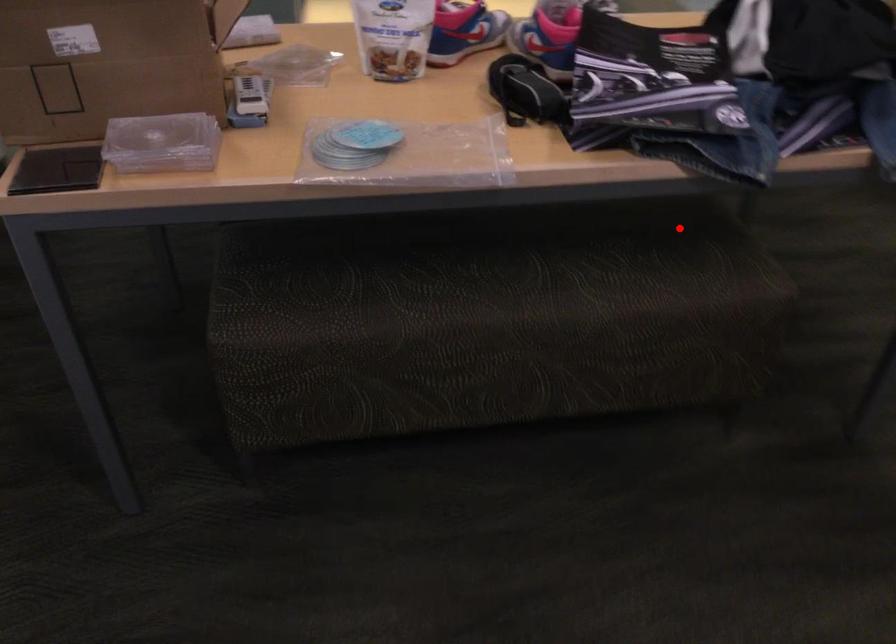
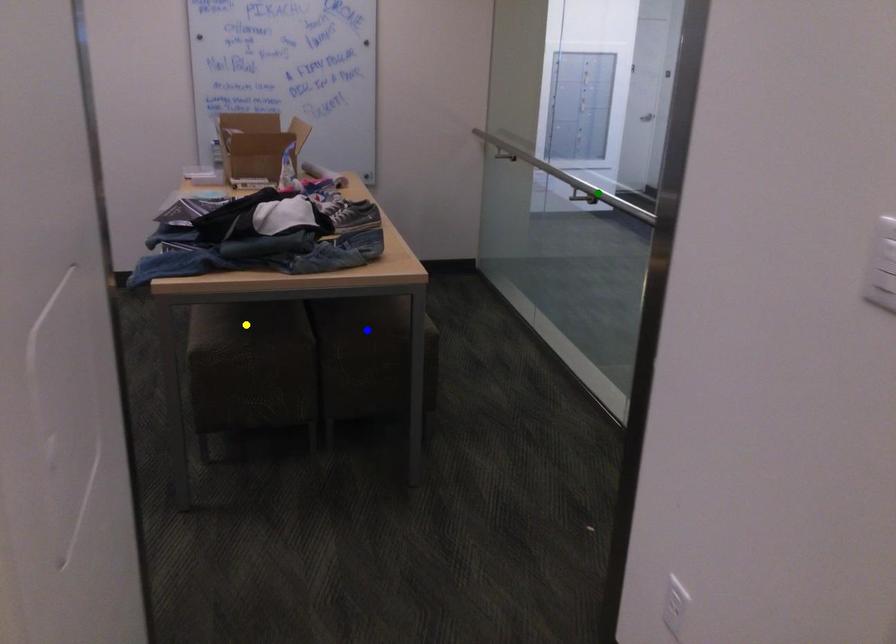
Question: I am providing you with two images of the same scene from different viewpoints. A red point is marked on the first image. You are given multiple points on the second image. Which spot in image 2 lines up with the point in image 1?

Choices:
 (A) yellow point
 (B) blue point
 (C) green point

Answer: (A)